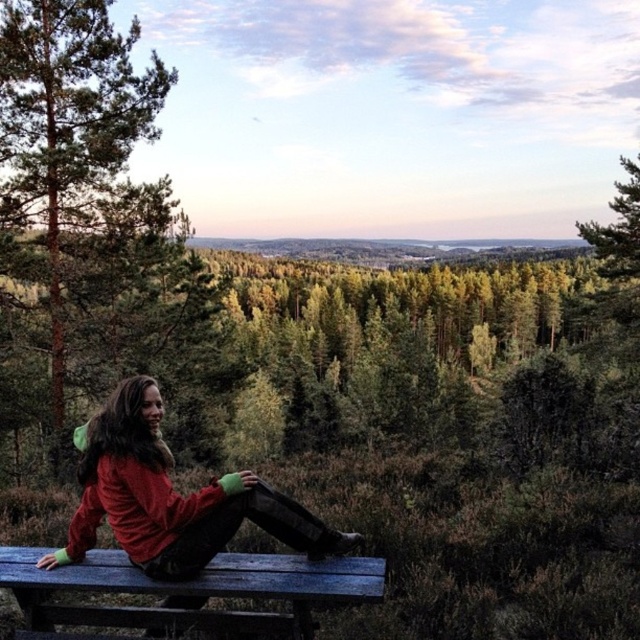
You are standing at the red fleece jacket at lower left and want to walk directly towards the green leafy tree at upper right. How far will you have to walk to reach the base of the tree?

The distance between the red fleece jacket at lower left and the green leafy tree at upper right is 23.34 meters, so you would need to walk approximately 23.34 meters to reach the base of the tree.

You are standing at the point marked by coordinates point (x=172, y=499). Looking around, you see a wooden bench painted blue slightly off to the left. Can you identify what object is located at your current position?

The point (x=172, y=499) indicates the location of the red fleece jacket at lower left.